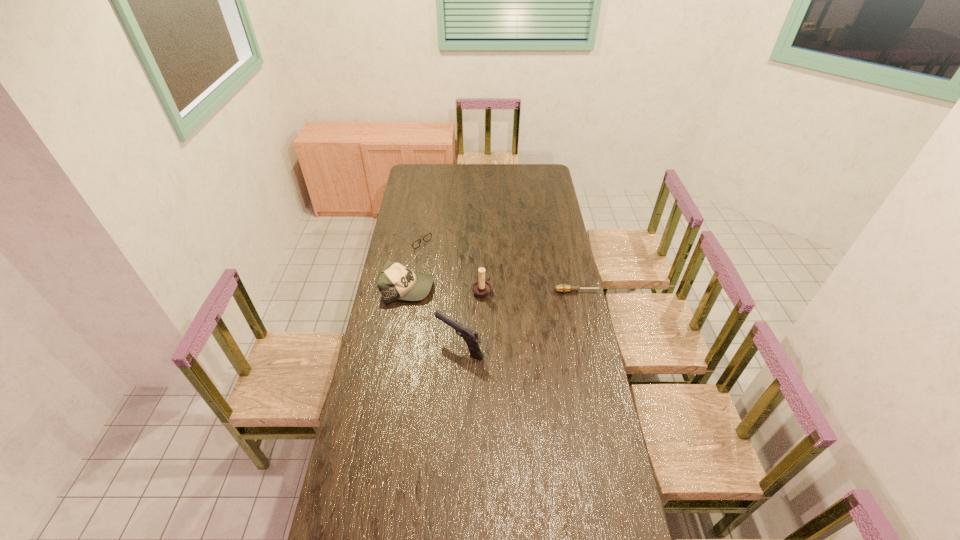
Locate an element on the screen. vacant space that satisfies the following two spatial constraints: 1. on the front side of the candle holder; 2. at the tip of the screwdriver is located at coordinates (482, 292).

Where is `free space that satisfies the following two spatial constraints: 1. on the front side of the baseball cap; 2. on the right side of the sunglasses`? free space that satisfies the following two spatial constraints: 1. on the front side of the baseball cap; 2. on the right side of the sunglasses is located at coordinates tap(404, 288).

This screenshot has height=540, width=960. I want to click on free space that satisfies the following two spatial constraints: 1. on the front side of the third tallest object; 2. at the muzzle of the gun, so click(398, 346).